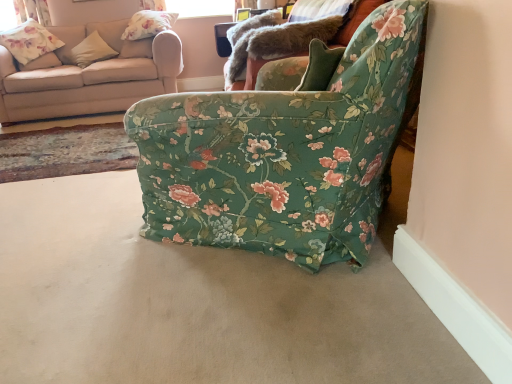
Question: Is floral fabric pillow at upper left, acting as the second pillow starting from the left, positioned in front of beige fabric couch at upper left?

Choices:
 (A) no
 (B) yes

Answer: (A)

Question: Does floral fabric pillow at upper left, acting as the second pillow starting from the left, have a greater height compared to beige fabric couch at upper left?

Choices:
 (A) yes
 (B) no

Answer: (B)

Question: Could you tell me if floral fabric pillow at upper left, which appears as the first pillow when viewed from the right, is facing beige fabric couch at upper left?

Choices:
 (A) yes
 (B) no

Answer: (A)

Question: Considering the relative sizes of floral fabric pillow at upper left, which appears as the first pillow when viewed from the right, and beige fabric couch at upper left in the image provided, is floral fabric pillow at upper left, which appears as the first pillow when viewed from the right, bigger than beige fabric couch at upper left?

Choices:
 (A) yes
 (B) no

Answer: (B)

Question: Is floral fabric pillow at upper left, acting as the second pillow starting from the left, at the left side of beige fabric couch at upper left?

Choices:
 (A) yes
 (B) no

Answer: (B)

Question: From the image's perspective, is beige carpet at lower center positioned above or below floral fabric pillow at upper left, which appears as the first pillow when viewed from the right?

Choices:
 (A) below
 (B) above

Answer: (A)

Question: Considering the positions of point (212, 372) and point (150, 29), is point (212, 372) closer or farther from the camera than point (150, 29)?

Choices:
 (A) farther
 (B) closer

Answer: (B)

Question: Considering the relative positions of beige carpet at lower center and floral fabric pillow at upper left, acting as the second pillow starting from the left, in the image provided, is beige carpet at lower center to the left or to the right of floral fabric pillow at upper left, acting as the second pillow starting from the left,?

Choices:
 (A) left
 (B) right

Answer: (B)

Question: Considering the positions of beige carpet at lower center and floral fabric pillow at upper left, which appears as the first pillow when viewed from the right, in the image, is beige carpet at lower center taller or shorter than floral fabric pillow at upper left, which appears as the first pillow when viewed from the right,?

Choices:
 (A) short
 (B) tall

Answer: (A)

Question: From a real-world perspective, is floral fabric armchair at center physically located above or below floral fabric curtain at upper left?

Choices:
 (A) above
 (B) below

Answer: (B)

Question: Is floral fabric armchair at center to the left or to the right of floral fabric curtain at upper left in the image?

Choices:
 (A) left
 (B) right

Answer: (B)

Question: Considering their positions, is floral fabric armchair at center located in front of or behind floral fabric curtain at upper left?

Choices:
 (A) front
 (B) behind

Answer: (A)

Question: Considering the positions of floral fabric armchair at center and floral fabric curtain at upper left in the image, is floral fabric armchair at center wider or thinner than floral fabric curtain at upper left?

Choices:
 (A) wide
 (B) thin

Answer: (A)

Question: Is beige fabric pillow at upper left, which is counted as the 2th pillow, starting from the right, inside the boundaries of floral fabric curtain at upper left, or outside?

Choices:
 (A) inside
 (B) outside

Answer: (B)

Question: Is beige fabric pillow at upper left, positioned as the 1th pillow in left-to-right order, wider or thinner than floral fabric curtain at upper left?

Choices:
 (A) wide
 (B) thin

Answer: (A)